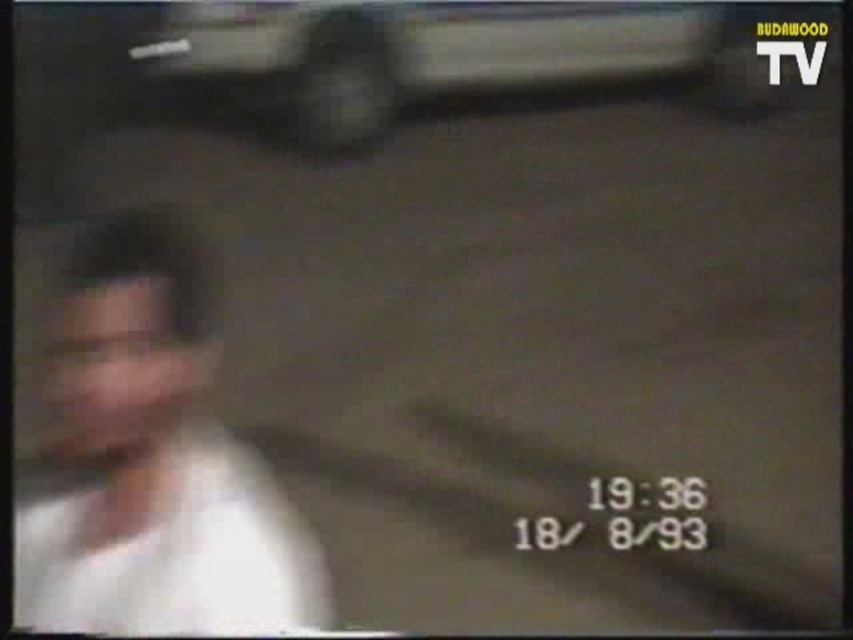
Is white matte shirt at left wider than metallic silver car at upper center?

Incorrect, white matte shirt at left's width does not surpass metallic silver car at upper center's.

Does white matte shirt at left have a smaller size compared to metallic silver car at upper center?

Incorrect, white matte shirt at left is not smaller in size than metallic silver car at upper center.

Who is more forward, (x=200, y=468) or (x=260, y=48)?

Point (x=260, y=48) is more forward.

I want to click on white matte shirt at left, so click(x=154, y=467).